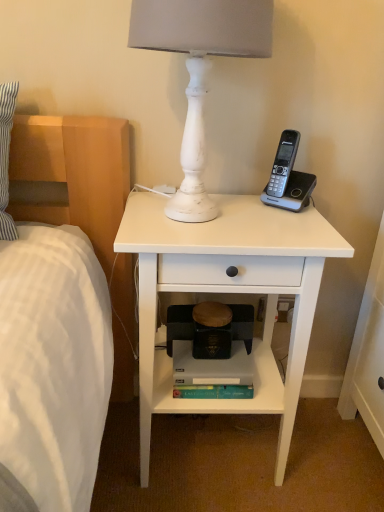
What do you see at coordinates (228, 292) in the screenshot? I see `white matte nightstand at center` at bounding box center [228, 292].

In order to click on wooden step stool at center in this screenshot , I will do `click(179, 324)`.

What is the approximate height of white distressed wood lamp at upper center?

The height of white distressed wood lamp at upper center is 17.11 inches.

This screenshot has height=512, width=384. I want to click on white matte nightstand at center, so click(228, 292).

Is there a large distance between white distressed wood lamp at upper center and white matte nightstand at center?

white distressed wood lamp at upper center is actually quite close to white matte nightstand at center.

Which object is positioned more to the left, white distressed wood lamp at upper center or white matte nightstand at center?

white distressed wood lamp at upper center is more to the left.

Considering the positions of objects white distressed wood lamp at upper center and white matte nightstand at center in the image provided, who is behind, white distressed wood lamp at upper center or white matte nightstand at center?

white matte nightstand at center.

Which object is wider, gray matte bookshelf at lower center or white matte nightstand at center?

white matte nightstand at center.

Is gray matte bookshelf at lower center next to white matte nightstand at center?

No, gray matte bookshelf at lower center is not next to white matte nightstand at center.

From a real-world perspective, is gray matte bookshelf at lower center positioned above or below white matte nightstand at center?

From a real-world perspective, gray matte bookshelf at lower center is physically below white matte nightstand at center.

What's the angular difference between gray matte bookshelf at lower center and white matte nightstand at center's facing directions?

They differ by 0.354 degrees in their facing directions.

Considering the positions of objects gray matte bookshelf at lower center and wooden step stool at center in the image provided, who is more to the left, gray matte bookshelf at lower center or wooden step stool at center?

gray matte bookshelf at lower center.

From a real-world perspective, is gray matte bookshelf at lower center on top of wooden step stool at center?

No, from a real-world perspective, gray matte bookshelf at lower center is not above wooden step stool at center.

Is gray matte bookshelf at lower center looking in the opposite direction of wooden step stool at center?

Yes, gray matte bookshelf at lower center's orientation is away from wooden step stool at center.

Which is further, (262, 388) or (185, 316)?

The point (185, 316) is farther from the camera.

Considering the relative sizes of white distressed wood lamp at upper center and wooden step stool at center in the image provided, is white distressed wood lamp at upper center shorter than wooden step stool at center?

Incorrect, the height of white distressed wood lamp at upper center does not fall short of that of wooden step stool at center.

Which object is thinner, white distressed wood lamp at upper center or wooden step stool at center?

Thinner between the two is wooden step stool at center.

Consider the image. From a real-world perspective, which is physically above, white distressed wood lamp at upper center or wooden step stool at center?

From a 3D spatial view, white distressed wood lamp at upper center is above.

What's the angular difference between white distressed wood lamp at upper center and wooden step stool at center's facing directions?

There is a 1.13-degree angle between the facing directions of white distressed wood lamp at upper center and wooden step stool at center.

Which is nearer, (177, 332) or (175, 208)?

The point (175, 208) is closer to the camera.

Is wooden step stool at center located outside white distressed wood lamp at upper center?

→ Yes, wooden step stool at center is located beyond the bounds of white distressed wood lamp at upper center.

Which of these two, wooden step stool at center or white distressed wood lamp at upper center, is bigger?

white distressed wood lamp at upper center is bigger.

From the image's perspective, is wooden step stool at center beneath white distressed wood lamp at upper center?

Correct, wooden step stool at center appears lower than white distressed wood lamp at upper center in the image.

Does wooden step stool at center have a greater height compared to white matte nightstand at center?

In fact, wooden step stool at center may be shorter than white matte nightstand at center.

From a real-world perspective, which object stands above the other?

white matte nightstand at center is physically above.

Locate an element on the screen. This screenshot has width=384, height=512. nightstand in front of the wooden step stool at center is located at coordinates (228, 292).

Would you say white matte nightstand at center is to the left or to the right of wooden step stool at center in the picture?

white matte nightstand at center is to the right of wooden step stool at center.

Is white matte nightstand at center turned away from wooden step stool at center?

Yes, wooden step stool at center is at the back of white matte nightstand at center.

Can you confirm if white matte nightstand at center is taller than wooden step stool at center?

Yes, white matte nightstand at center is taller than wooden step stool at center.

From the image's perspective, between white matte nightstand at center and wooden step stool at center, which one is located above?

wooden step stool at center, from the image's perspective.

I want to click on nightstand on the right of white distressed wood lamp at upper center, so click(228, 292).

Where is `nightstand that appears in front of the gray matte bookshelf at lower center`? nightstand that appears in front of the gray matte bookshelf at lower center is located at coordinates (228, 292).

Which object lies nearer to the anchor point white matte nightstand at center, white distressed wood lamp at upper center or gray matte bookshelf at lower center?

gray matte bookshelf at lower center is closer to white matte nightstand at center.

Based on their spatial positions, is wooden step stool at center or white matte nightstand at center closer to gray matte bookshelf at lower center?

The object closer to gray matte bookshelf at lower center is wooden step stool at center.

Estimate the real-world distances between objects in this image. Which object is closer to white distressed wood lamp at upper center, gray matte bookshelf at lower center or white matte nightstand at center?

white matte nightstand at center is closer to white distressed wood lamp at upper center.

Which object lies nearer to the anchor point white distressed wood lamp at upper center, wooden step stool at center or gray matte bookshelf at lower center?

Among the two, wooden step stool at center is located nearer to white distressed wood lamp at upper center.

Looking at the image, which one is located further to wooden step stool at center, white matte nightstand at center or white distressed wood lamp at upper center?

white distressed wood lamp at upper center is further to wooden step stool at center.

Looking at this image, when comparing their distances from gray matte bookshelf at lower center, does white matte nightstand at center or white distressed wood lamp at upper center seem closer?

Based on the image, white matte nightstand at center appears to be nearer to gray matte bookshelf at lower center.

Looking at the image, which one is located closer to gray matte bookshelf at lower center, white matte nightstand at center or wooden step stool at center?

The object closer to gray matte bookshelf at lower center is wooden step stool at center.

From the image, which object appears to be farther from white distressed wood lamp at upper center, gray matte bookshelf at lower center or wooden step stool at center?

gray matte bookshelf at lower center is further to white distressed wood lamp at upper center.

Image resolution: width=384 pixels, height=512 pixels. I want to click on nightstand between white distressed wood lamp at upper center and gray matte bookshelf at lower center from top to bottom, so click(x=228, y=292).

Image resolution: width=384 pixels, height=512 pixels. In order to click on step stool between white distressed wood lamp at upper center and gray matte bookshelf at lower center in the up-down direction in this screenshot , I will do `click(179, 324)`.

Image resolution: width=384 pixels, height=512 pixels. I want to click on shelf between white matte nightstand at center and wooden step stool at center from front to back, so click(x=224, y=399).

Identify the location of step stool between white distressed wood lamp at upper center and white matte nightstand at center in the vertical direction. (179, 324).